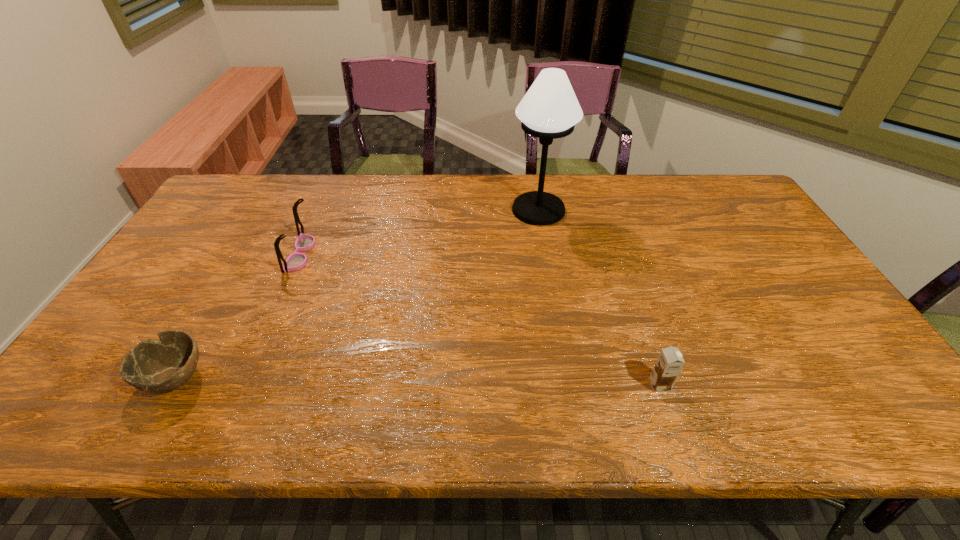
Identify the location of the farthest object. [549, 110].

Identify the location of the third object from left to right. (549, 110).

Locate an element on the screen. This screenshot has width=960, height=540. the second object from left to right is located at coordinates (295, 261).

At what (x,y) coordinates should I click in order to perform the action: click on spectacles. Please return your answer as a coordinate pair (x, y). The width and height of the screenshot is (960, 540). Looking at the image, I should click on (295, 261).

The height and width of the screenshot is (540, 960). Find the location of `the third tallest object`. the third tallest object is located at coordinates (670, 362).

The height and width of the screenshot is (540, 960). I want to click on the rightmost object, so click(670, 362).

Locate an element on the screen. This screenshot has width=960, height=540. the shortest object is located at coordinates (155, 366).

You are a GUI agent. You are given a task and a screenshot of the screen. Output one action in this format:
    pyautogui.click(x=<x>, y=<y>)
    Task: Click on the leftmost object
    The image size is (960, 540).
    Given the screenshot: What is the action you would take?
    pyautogui.click(x=155, y=366)

At what (x,y) coordinates should I click in order to perform the action: click on blank space located 0.060m on the left of the tallest object. Please return your answer as a coordinate pair (x, y). Looking at the image, I should click on (492, 210).

Locate an element on the screen. The image size is (960, 540). free spot located 0.360m on the right of the spectacles is located at coordinates (431, 254).